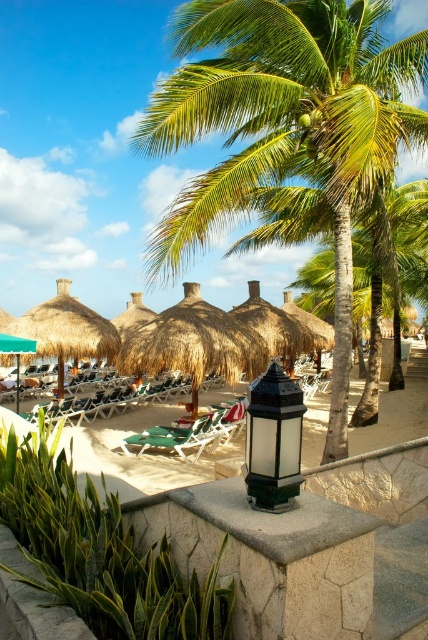
You are standing at the entrance of the beach area and see the green glass lantern at center. If you walk straight towards the water, will the lantern be behind you or in front of you?

The green glass lantern at center is located at point [273,442], which means it is positioned behind you relative to your direction of movement towards the water. Therefore, the lantern will be behind you as you walk straight towards the water.

You are a guest at the beach resort and want to place a small umbrella between the green leafy palm tree at center and the green glass lantern at center. Based on their positions, which object should the umbrella be closer to?

The green leafy palm tree at center is located above the green glass lantern at center, so the umbrella should be placed closer to the green glass lantern at center since it is lower and the palm tree is higher.